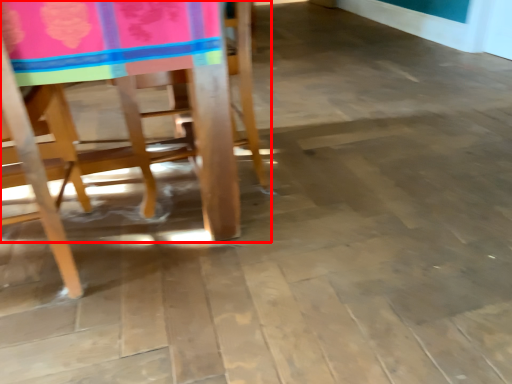
Question: Where is chair (annotated by the red box) located in relation to chair in the image?

Choices:
 (A) right
 (B) left

Answer: (A)